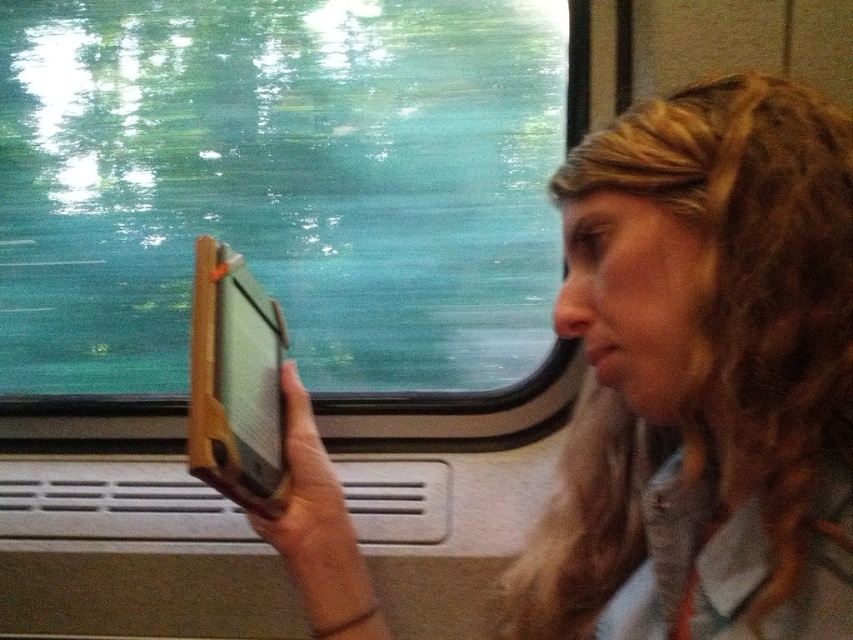
Between point (572, 545) and point (244, 429), which one is positioned in front?

Positioned in front is point (572, 545).

Consider the image. Measure the distance between point (740, 387) and camera.

Point (740, 387) and camera are 22.63 inches apart from each other.

Who is more forward, (788,120) or (242,264)?

Point (788,120)

Image resolution: width=853 pixels, height=640 pixels. I want to click on matte black tablet at center, so click(703, 374).

Is transparent glass train window at center to the left of wooden tablet at center from the viewer's perspective?

Yes, transparent glass train window at center is to the left of wooden tablet at center.

Between transparent glass train window at center and wooden tablet at center, which one is positioned lower?

wooden tablet at center is lower down.

Find the location of a particular element. transparent glass train window at center is located at coordinates [x=283, y=186].

At what (x,y) coordinates should I click in order to perform the action: click on transparent glass train window at center. Please return your answer as a coordinate pair (x, y). This screenshot has width=853, height=640. Looking at the image, I should click on (283, 186).

Who is positioned more to the left, transparent glass train window at center or matte black tablet at center?

Positioned to the left is transparent glass train window at center.

Is transparent glass train window at center smaller than matte black tablet at center?

No, transparent glass train window at center is not smaller than matte black tablet at center.

Find the location of a particular element. This screenshot has width=853, height=640. transparent glass train window at center is located at coordinates (283, 186).

The height and width of the screenshot is (640, 853). In order to click on transparent glass train window at center in this screenshot , I will do `click(283, 186)`.